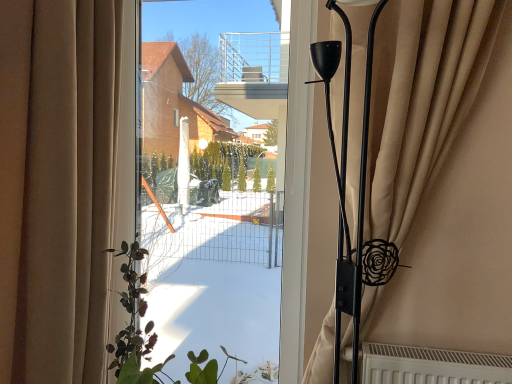
Question: Can you confirm if green matte plant at left is bigger than beige fabric curtain at left, marked as the 2th curtain in a right-to-left arrangement?

Choices:
 (A) yes
 (B) no

Answer: (B)

Question: Does green matte plant at left have a smaller size compared to beige fabric curtain at left, marked as the 2th curtain in a right-to-left arrangement?

Choices:
 (A) yes
 (B) no

Answer: (A)

Question: Considering the relative positions of green matte plant at left and beige fabric curtain at left, marked as the 2th curtain in a right-to-left arrangement, in the image provided, is green matte plant at left to the right of beige fabric curtain at left, marked as the 2th curtain in a right-to-left arrangement, from the viewer's perspective?

Choices:
 (A) yes
 (B) no

Answer: (A)

Question: Does green matte plant at left have a greater width compared to beige fabric curtain at left, acting as the 1th curtain starting from the left?

Choices:
 (A) no
 (B) yes

Answer: (B)

Question: Is green matte plant at left far from beige fabric curtain at left, marked as the 2th curtain in a right-to-left arrangement?

Choices:
 (A) yes
 (B) no

Answer: (B)

Question: Is green matte plant at left further to the viewer compared to beige fabric curtain at left, marked as the 2th curtain in a right-to-left arrangement?

Choices:
 (A) yes
 (B) no

Answer: (A)

Question: Does beige fabric curtain at left, acting as the 1th curtain starting from the left, lie behind transparent glass window screen at center?

Choices:
 (A) no
 (B) yes

Answer: (A)

Question: Is beige fabric curtain at left, marked as the 2th curtain in a right-to-left arrangement, positioned in front of transparent glass window screen at center?

Choices:
 (A) no
 (B) yes

Answer: (B)

Question: From the image's perspective, is beige fabric curtain at left, marked as the 2th curtain in a right-to-left arrangement, located above transparent glass window screen at center?

Choices:
 (A) no
 (B) yes

Answer: (A)

Question: Could you tell me if beige fabric curtain at left, marked as the 2th curtain in a right-to-left arrangement, is turned towards transparent glass window screen at center?

Choices:
 (A) no
 (B) yes

Answer: (A)

Question: Is beige fabric curtain at left, marked as the 2th curtain in a right-to-left arrangement, to the left of transparent glass window screen at center from the viewer's perspective?

Choices:
 (A) yes
 (B) no

Answer: (A)

Question: Does beige fabric curtain at left, marked as the 2th curtain in a right-to-left arrangement, have a lesser width compared to transparent glass window screen at center?

Choices:
 (A) yes
 (B) no

Answer: (B)

Question: Would you consider beige fabric curtain at left, marked as the 2th curtain in a right-to-left arrangement, to be distant from beige fabric curtain at right, which appears as the second curtain when viewed from the left?

Choices:
 (A) no
 (B) yes

Answer: (A)